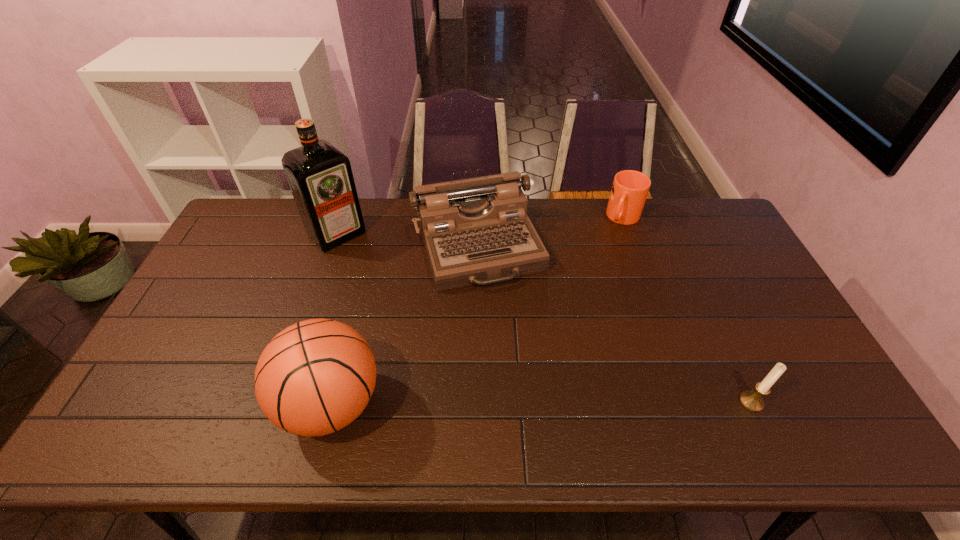
Identify the location of free region located on the keyboard of the third object from right to left. (528, 373).

I want to click on vacant space situated on the front label of the tallest object, so pyautogui.click(x=420, y=319).

The image size is (960, 540). In order to click on vacant space located on the front label of the tallest object in this screenshot , I will do `click(383, 281)`.

Locate an element on the screen. The image size is (960, 540). vacant space situated 0.350m on the front label of the tallest object is located at coordinates (411, 309).

You are a GUI agent. You are given a task and a screenshot of the screen. Output one action in this format:
    pyautogui.click(x=<x>, y=<y>)
    Task: Click on the vacant space located 0.300m on the handle side of the mug
    This screenshot has width=960, height=540.
    Given the screenshot: What is the action you would take?
    pyautogui.click(x=594, y=286)

This screenshot has width=960, height=540. I want to click on vacant region located 0.330m on the handle side of the mug, so click(x=591, y=292).

This screenshot has height=540, width=960. Find the location of `vacant space located on the handle side of the mug`. vacant space located on the handle side of the mug is located at coordinates (586, 303).

The width and height of the screenshot is (960, 540). In order to click on typewriter that is at the far edge in this screenshot , I will do `click(478, 228)`.

Find the location of a particular element. The height and width of the screenshot is (540, 960). liquor present at the far edge is located at coordinates (320, 177).

Identify the location of mug present at the far edge. This screenshot has width=960, height=540. (630, 188).